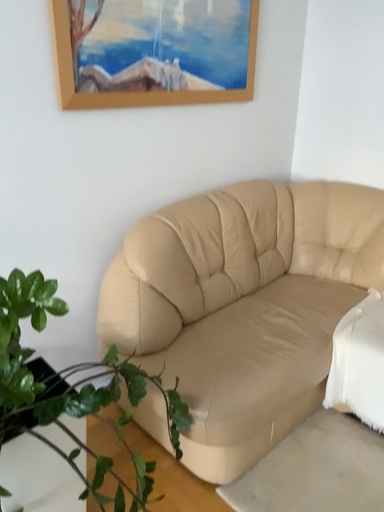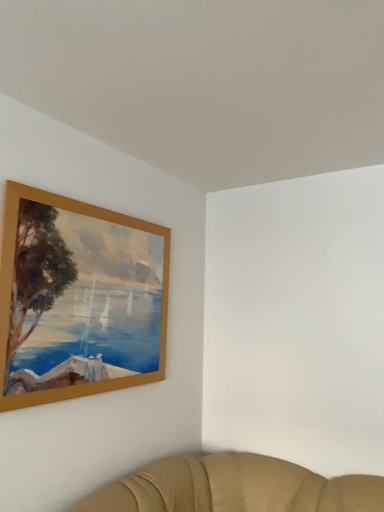
Question: Which way did the camera rotate in the video?

Choices:
 (A) rotated right
 (B) rotated left

Answer: (A)